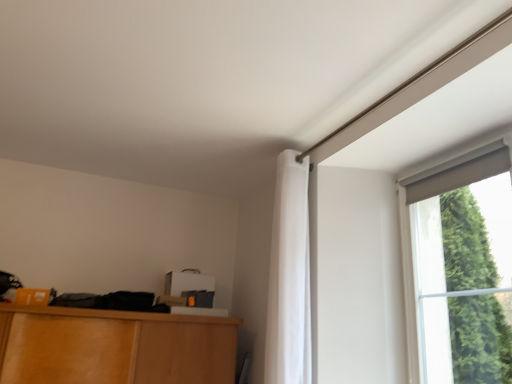
Question: Considering their positions, is white fabric curtain at upper right located in front of or behind matte gray curtain at upper right?

Choices:
 (A) behind
 (B) front

Answer: (A)

Question: Considering the positions of white fabric curtain at upper right and matte gray curtain at upper right in the image, is white fabric curtain at upper right wider or thinner than matte gray curtain at upper right?

Choices:
 (A) thin
 (B) wide

Answer: (B)

Question: From a real-world perspective, is white fabric curtain at upper right above or below matte gray curtain at upper right?

Choices:
 (A) below
 (B) above

Answer: (B)

Question: Is matte gray curtain at upper right wider or thinner than white fabric curtain at upper right?

Choices:
 (A) thin
 (B) wide

Answer: (A)

Question: Considering their positions, is matte gray curtain at upper right located in front of or behind white fabric curtain at upper right?

Choices:
 (A) behind
 (B) front

Answer: (B)

Question: Considering the positions of matte gray curtain at upper right and white fabric curtain at upper right in the image, is matte gray curtain at upper right taller or shorter than white fabric curtain at upper right?

Choices:
 (A) short
 (B) tall

Answer: (A)

Question: Choose the correct answer: Is matte gray curtain at upper right inside white fabric curtain at upper right or outside it?

Choices:
 (A) inside
 (B) outside

Answer: (B)